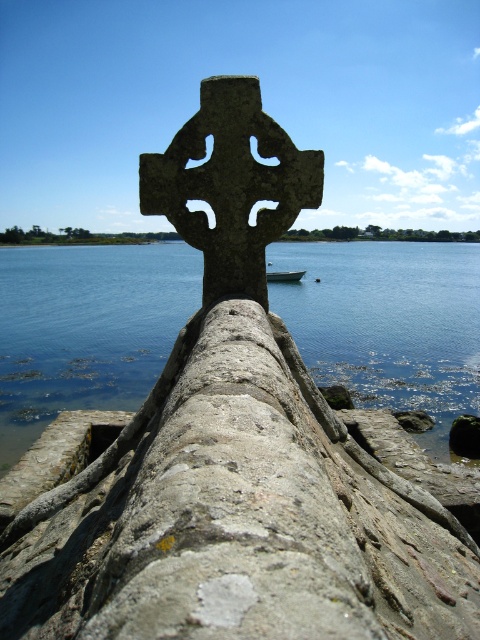
Between blue water at center and white matte boat at center, which one appears on the left side from the viewer's perspective?

blue water at center is more to the left.

Between point (429, 320) and point (299, 273), which one is positioned in front?

Point (429, 320) is more forward.

Is point (26, 416) closer to camera compared to point (300, 273)?

Yes, it is in front of point (300, 273).

What are the coordinates of `blue water at center` in the screenshot? It's located at (387, 323).